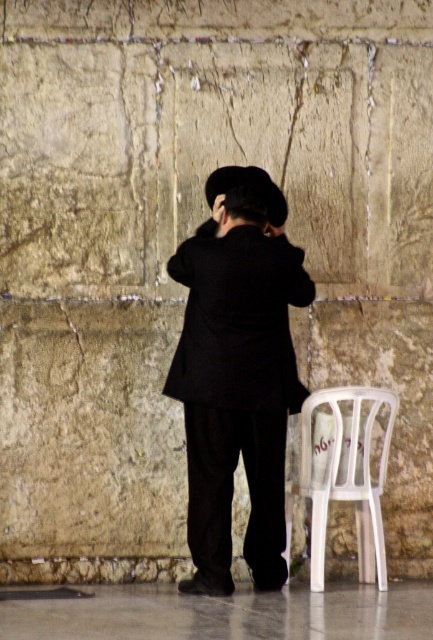
Is point (307, 396) positioned before point (236, 179)?

Yes, it is in front of point (236, 179).

Can you confirm if white plastic chair at lower right is positioned below black felt hat at center?

Yes.

The image size is (433, 640). I want to click on white plastic chair at lower right, so click(342, 474).

How much distance is there between matte black coat at center and white plastic chair at lower right?

matte black coat at center and white plastic chair at lower right are 16.92 inches apart.

Who is more distant from viewer, [210,296] or [287,524]?

The point [287,524] is more distant.

Find the location of `matte black coat at center`. matte black coat at center is located at coordinates (238, 372).

Is matte black coat at center to the right of black felt hat at center from the viewer's perspective?

In fact, matte black coat at center is to the left of black felt hat at center.

Does matte black coat at center appear on the left side of black felt hat at center?

Indeed, matte black coat at center is positioned on the left side of black felt hat at center.

Identify the location of matte black coat at center. The image size is (433, 640). [x=238, y=372].